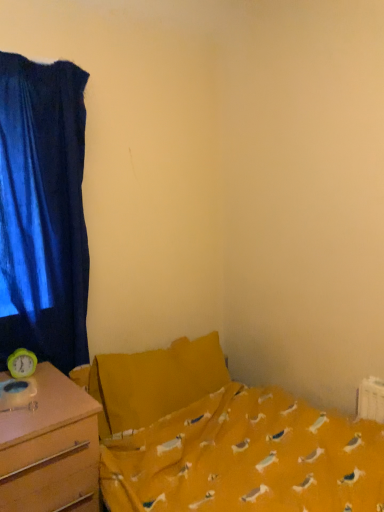
The height and width of the screenshot is (512, 384). Describe the element at coordinates (222, 439) in the screenshot. I see `yellow fabric bed at center` at that location.

Describe the element at coordinates (43, 211) in the screenshot. The width and height of the screenshot is (384, 512). I see `velvet blue curtain at left` at that location.

What do you see at coordinates (49, 446) in the screenshot? This screenshot has height=512, width=384. I see `wooden desk at left` at bounding box center [49, 446].

Where is `yellow fabric bed at center`? Image resolution: width=384 pixels, height=512 pixels. yellow fabric bed at center is located at coordinates (222, 439).

From a real-world perspective, which object stands above the other?

yellow fabric bed at center, from a real-world perspective.

How many degrees apart are the facing directions of wooden desk at left and yellow fabric bed at center?

0.169 degrees separate the facing orientations of wooden desk at left and yellow fabric bed at center.

Can you confirm if wooden desk at left is bigger than yellow fabric bed at center?

No, wooden desk at left is not bigger than yellow fabric bed at center.

Does yellow fabric bed at center lie in front of velvet blue curtain at left?

Yes, it is.

Are yellow fabric bed at center and velvet blue curtain at left located far from each other?

No, yellow fabric bed at center is not far from velvet blue curtain at left.

Between yellow fabric bed at center and velvet blue curtain at left, which one has larger size?

With larger size is yellow fabric bed at center.

Looking at this image, from the image's perspective, would you say yellow fabric bed at center is shown under velvet blue curtain at left?

Indeed, from the image's perspective, yellow fabric bed at center is shown beneath velvet blue curtain at left.

Would you say wooden desk at left contains velvet blue curtain at left?

No, velvet blue curtain at left is not a part of wooden desk at left.

Is point (54, 476) closer or farther from the camera than point (17, 234)?

Clearly, point (54, 476) is closer to the camera than point (17, 234).

From the image's perspective, is wooden desk at left positioned above or below velvet blue curtain at left?

wooden desk at left is situated lower than velvet blue curtain at left in the image.

Between wooden desk at left and velvet blue curtain at left, which one has more height?

velvet blue curtain at left.

Can you tell me how much velvet blue curtain at left and wooden desk at left differ in facing direction?

The angle between the facing direction of velvet blue curtain at left and the facing direction of wooden desk at left is 0.599 degrees.

Which is more to the right, velvet blue curtain at left or wooden desk at left?

wooden desk at left is more to the right.

Considering the positions of points (82, 141) and (23, 496), is point (82, 141) farther from camera compared to point (23, 496)?

Yes, it is behind point (23, 496).

From the image's perspective, is velvet blue curtain at left over wooden desk at left?

Yes, from the image's perspective, velvet blue curtain at left is on top of wooden desk at left.

Is yellow fabric bed at center positioned beyond the bounds of wooden desk at left?

Yes, yellow fabric bed at center is located beyond the bounds of wooden desk at left.

Locate an element on the screen. This screenshot has width=384, height=512. desk in front of the yellow fabric bed at center is located at coordinates (49, 446).

Does yellow fabric bed at center appear on the right side of wooden desk at left?

Yes, yellow fabric bed at center is to the right of wooden desk at left.

From a real-world perspective, who is located higher, velvet blue curtain at left or yellow fabric bed at center?

In real-world perspective, velvet blue curtain at left is above.

Based on the photo, is yellow fabric bed at center at the back of velvet blue curtain at left?

No.

Image resolution: width=384 pixels, height=512 pixels. What are the coordinates of `curtain on the left of yellow fabric bed at center` in the screenshot? It's located at (43, 211).

Find the location of `desk that is below the yellow fabric bed at center (from the image's perspective)`. desk that is below the yellow fabric bed at center (from the image's perspective) is located at coordinates (49, 446).

The height and width of the screenshot is (512, 384). Find the location of `curtain located behind the yellow fabric bed at center`. curtain located behind the yellow fabric bed at center is located at coordinates (43, 211).

From the image, which object appears to be nearer to yellow fabric bed at center, velvet blue curtain at left or wooden desk at left?

wooden desk at left is positioned closer to the anchor yellow fabric bed at center.

Looking at the image, which one is located closer to velvet blue curtain at left, wooden desk at left or yellow fabric bed at center?

The object closer to velvet blue curtain at left is wooden desk at left.

Looking at the image, which one is located closer to velvet blue curtain at left, yellow fabric bed at center or wooden desk at left?

wooden desk at left is closer to velvet blue curtain at left.

Looking at the image, which one is located closer to wooden desk at left, yellow fabric bed at center or velvet blue curtain at left?

The object closer to wooden desk at left is yellow fabric bed at center.

When comparing their distances from yellow fabric bed at center, does wooden desk at left or velvet blue curtain at left seem further?

velvet blue curtain at left.

Looking at the image, which one is located closer to wooden desk at left, velvet blue curtain at left or yellow fabric bed at center?

yellow fabric bed at center is closer to wooden desk at left.

Locate an element on the screen. This screenshot has height=512, width=384. bed between velvet blue curtain at left and wooden desk at left in the vertical direction is located at coordinates (222, 439).